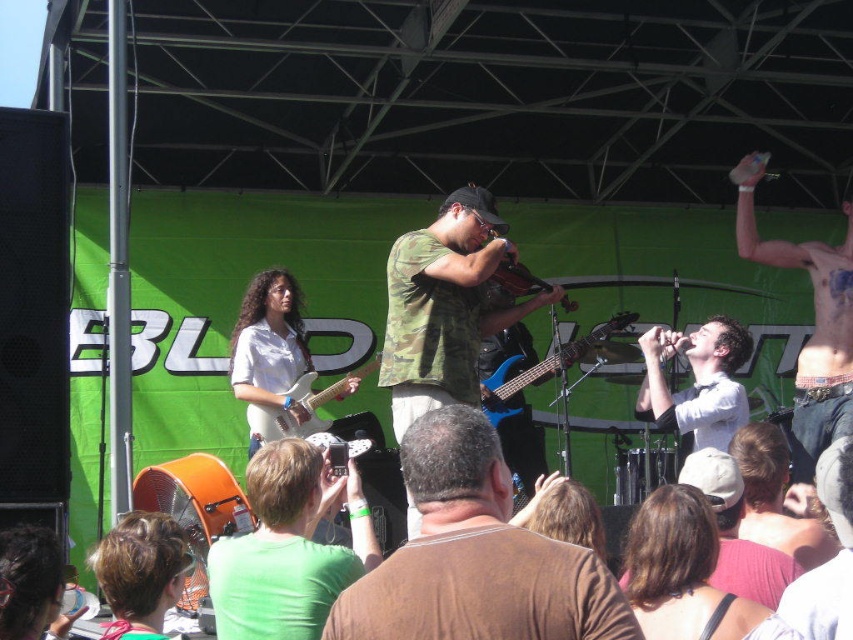
You are a photographer at the concert and want to capture a photo of the two performers at the center. The white shirt at center and the light brown hair at center are both in your viewfinder. Based on their positions, which performer should you focus on first to ensure they are in the foreground?

The white shirt at center is taller than light brown hair at center, so you should focus on the white shirt at center first since it is closer to the camera and in the foreground.